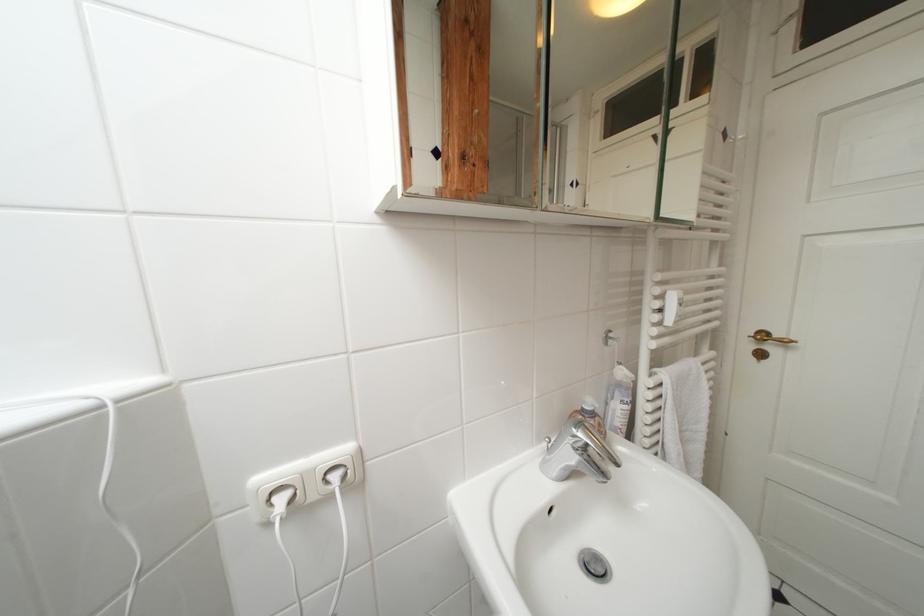
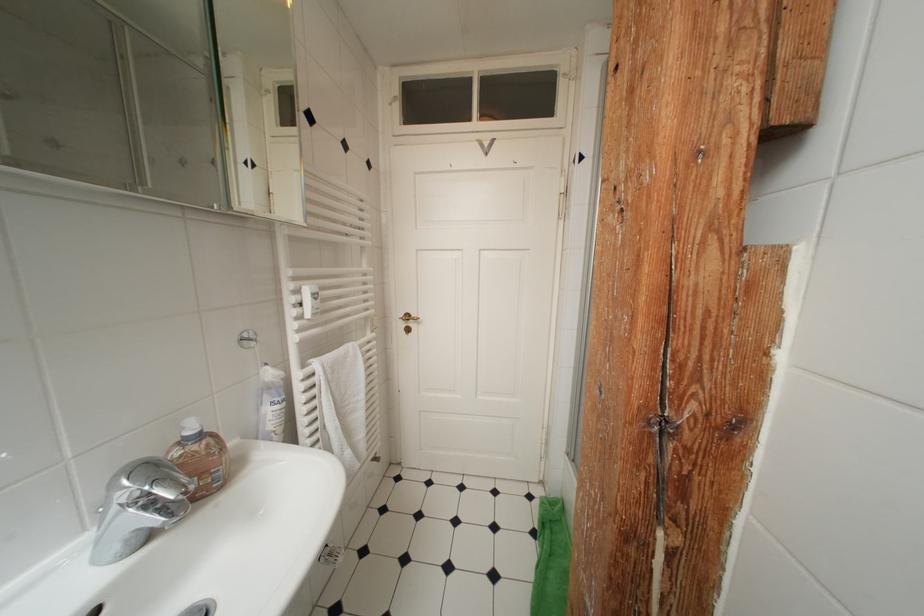
Locate, in the second image, the point that corresponds to point (578, 188) in the first image.

(253, 167)